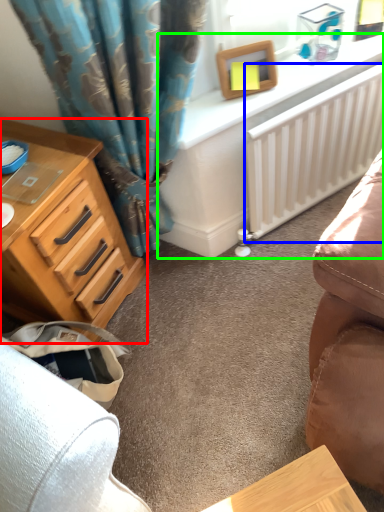
Question: Based on their relative distances, which object is farther from chest of drawers (highlighted by a red box)? Choose from radiator (highlighted by a blue box) and computer desk (highlighted by a green box).

Choices:
 (A) radiator
 (B) computer desk

Answer: (A)